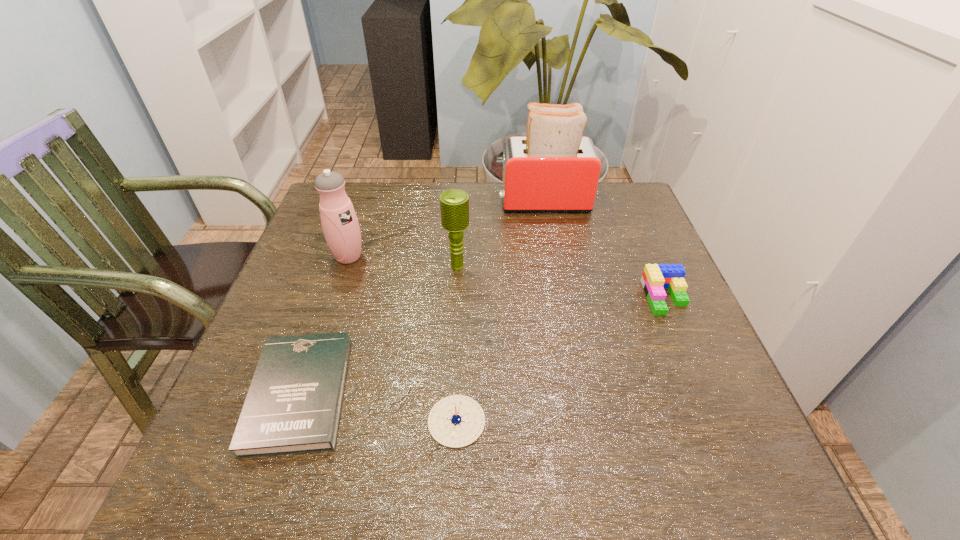
Identify the location of free region located 0.260m on the front-facing side of the farthest object. This screenshot has height=540, width=960. (405, 201).

Locate an element on the screen. free location located on the right of the thermos bottle is located at coordinates [414, 256].

Where is `vacant space located 0.400m on the right of the microphone`? vacant space located 0.400m on the right of the microphone is located at coordinates (636, 266).

Find the location of `vacant space located on the left of the Lego`. vacant space located on the left of the Lego is located at coordinates (611, 297).

This screenshot has height=540, width=960. Identify the location of free point located on the right of the compass. (692, 421).

Image resolution: width=960 pixels, height=540 pixels. Find the location of `free spot located 0.370m on the back of the shortest object`. free spot located 0.370m on the back of the shortest object is located at coordinates (355, 232).

Image resolution: width=960 pixels, height=540 pixels. Find the location of `object at the far edge`. object at the far edge is located at coordinates (554, 169).

You are a GUI agent. You are given a task and a screenshot of the screen. Output one action in this format:
    pyautogui.click(x=<x>, y=<y>)
    Task: Click on the compass present at the near edge
    The height and width of the screenshot is (540, 960).
    Given the screenshot: What is the action you would take?
    pyautogui.click(x=456, y=421)

Where is `book that is at the near edge`? book that is at the near edge is located at coordinates (293, 406).

Image resolution: width=960 pixels, height=540 pixels. What are the coordinates of `thermos bottle present at the left edge` in the screenshot? It's located at (341, 229).